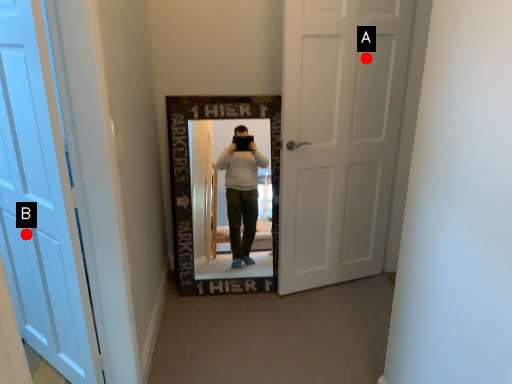
Question: Two points are circled on the image, labeled by A and B beside each circle. Which point appears closest to the camera in this image?

Choices:
 (A) A is closer
 (B) B is closer

Answer: (B)